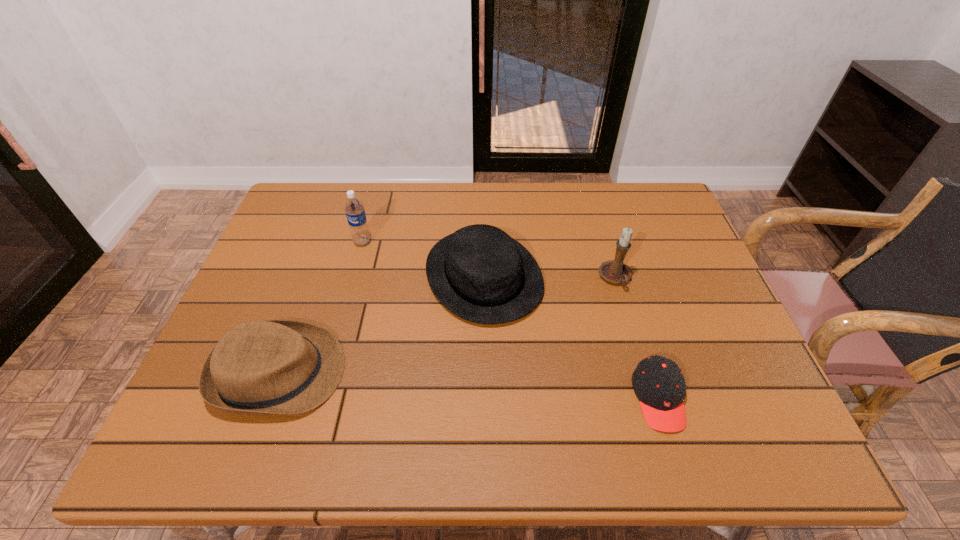
Where is `water bottle`? Image resolution: width=960 pixels, height=540 pixels. water bottle is located at coordinates (354, 209).

You are a GUI agent. You are given a task and a screenshot of the screen. Output one action in this format:
    pyautogui.click(x=<x>, y=<y>)
    Task: Click on the candle holder
    This screenshot has width=960, height=540.
    Given the screenshot: What is the action you would take?
    pyautogui.click(x=616, y=272)

The image size is (960, 540). Identify the location of the farther fedora. (479, 273).

This screenshot has height=540, width=960. I want to click on the right fedora, so click(x=479, y=273).

In order to click on the left fedora in this screenshot , I will do `click(267, 367)`.

Where is `the shortest object`? the shortest object is located at coordinates (658, 382).

This screenshot has height=540, width=960. I want to click on vacant space located 0.210m on the left of the water bottle, so click(282, 242).

The height and width of the screenshot is (540, 960). Identify the location of vacant position located 0.380m on the side of the candle holder with the handle. (661, 433).

Image resolution: width=960 pixels, height=540 pixels. In order to click on vacant space situated on the left of the farther fedora in this screenshot , I will do `click(381, 275)`.

Locate an element on the screen. The image size is (960, 540). free location located 0.330m on the front-facing side of the left fedora is located at coordinates (491, 373).